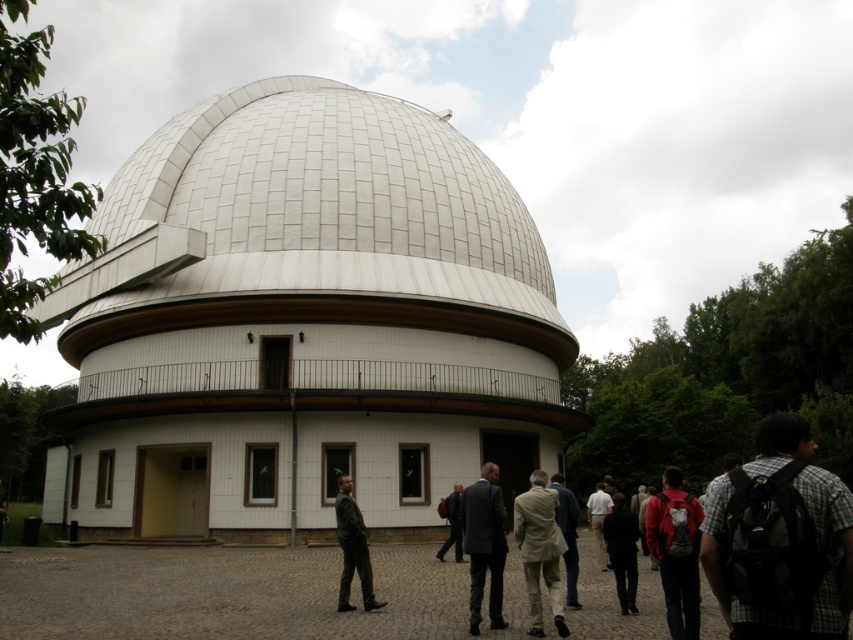
You are a visitor at the observatory and see both the plaid shirt backpack at lower right and the red backpack at lower right. Which backpack is shorter in height?

The plaid shirt backpack at lower right is not as tall as the red backpack at lower right, so the plaid shirt backpack at lower right is shorter in height.

You are standing at the entrance of the observatory and see both the dark brown leather jacket at center and the black fabric jacket at lower center. Which jacket is positioned closer to the left side of the entrance?

The dark brown leather jacket at center is positioned to the left of the black fabric jacket at lower center, so it is closer to the left side of the entrance.